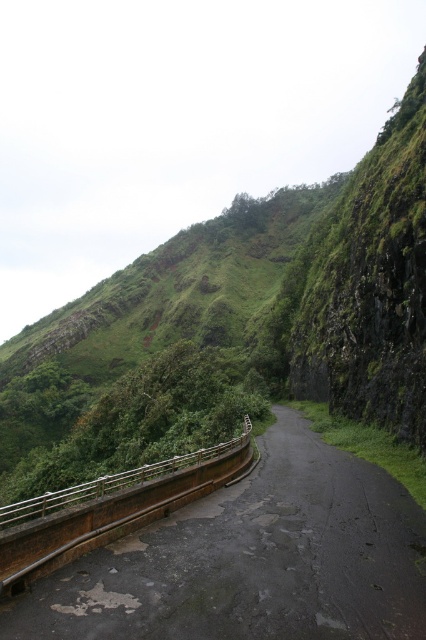
Consider the image. You are driving a delivery truck that needs to pass through the dark asphalt road at center. There is a metallic gray rail at lower left nearby. Based on their positions, can you safely navigate your truck to avoid the rail?

The dark asphalt road at center is located above the metallic gray rail at lower left, meaning the rail is positioned lower than the road. Since the road is above, the truck can safely navigate on the road without hitting the rail as they are at different elevation levels.

You are driving a car with a width of 6 feet. You need to pass through the area where the dark asphalt road at center and the metallic gray rail at lower left are located. Can your car safely navigate this part of the road without touching the rail?

The dark asphalt road at center is 15.19 feet away from the metallic gray rail at lower left. Since the car is only 6 feet wide, there is sufficient space between the road and the rail for the car to pass safely without touching the rail.

You are a hiker planning to walk along the dark asphalt road at center and the metallic gray rail at lower left. Which path is longer?

The metallic gray rail at lower left is longer than the dark asphalt road at center.